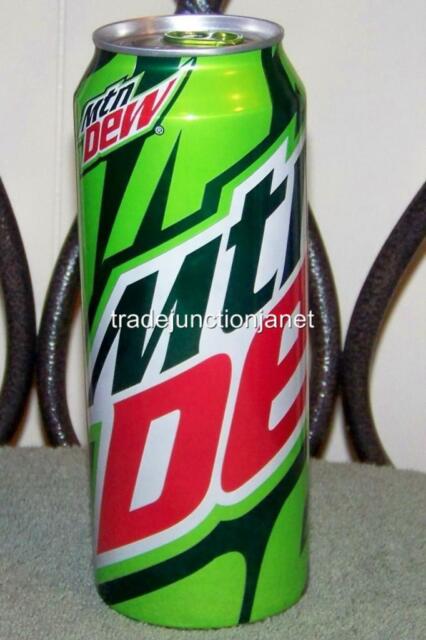
The width and height of the screenshot is (426, 640). I want to click on wall behind can, so click(46, 93).